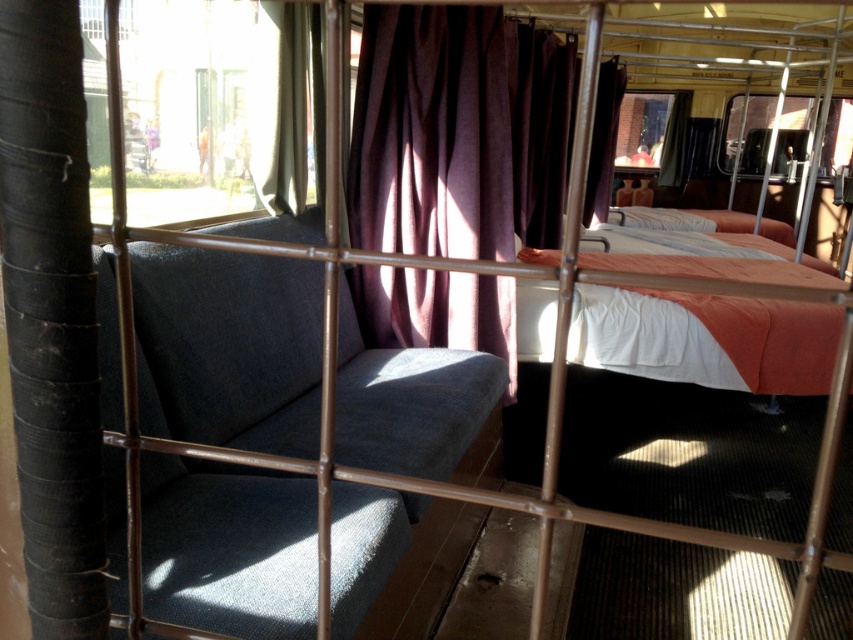
Is purple fabric curtain at center smaller than white cotton bed at center?

Correct, purple fabric curtain at center occupies less space than white cotton bed at center.

Can you confirm if purple fabric curtain at center is positioned below white cotton bed at center?

No, purple fabric curtain at center is not below white cotton bed at center.

Identify the location of purple fabric curtain at center. This screenshot has height=640, width=853. (431, 132).

Find the location of a particular element. This screenshot has width=853, height=640. purple fabric curtain at center is located at coordinates (431, 132).

Who is positioned more to the left, purple fabric curtain at center or matte purple curtain at upper left?

matte purple curtain at upper left is more to the left.

Is purple fabric curtain at center behind matte purple curtain at upper left?

Yes, it is behind matte purple curtain at upper left.

Does point (474, 136) come closer to viewer compared to point (258, 81)?

No.

Image resolution: width=853 pixels, height=640 pixels. I want to click on purple fabric curtain at center, so click(x=431, y=132).

Who is lower down, white cotton bed at center or matte purple curtain at upper left?

white cotton bed at center

Does white cotton bed at center appear on the left side of matte purple curtain at upper left?

In fact, white cotton bed at center is to the right of matte purple curtain at upper left.

Is point (596, 332) in front of point (291, 129)?

No, it is not.

What are the coordinates of `white cotton bed at center` in the screenshot? It's located at (705, 339).